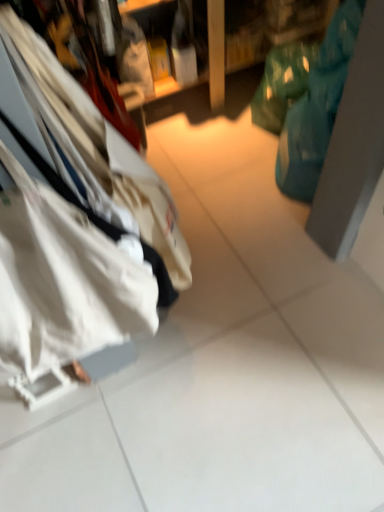
Measure the distance between point (3,315) and camera.

A distance of 27.99 inches exists between point (3,315) and camera.

At what (x,y) coordinates should I click in order to perform the action: click on white fabric tote at left. Please return your answer as a coordinate pair (x, y). Looking at the image, I should click on (66, 284).

This screenshot has height=512, width=384. What do you see at coordinates (66, 284) in the screenshot?
I see `white fabric tote at left` at bounding box center [66, 284].

Image resolution: width=384 pixels, height=512 pixels. I want to click on white fabric tote at left, so click(66, 284).